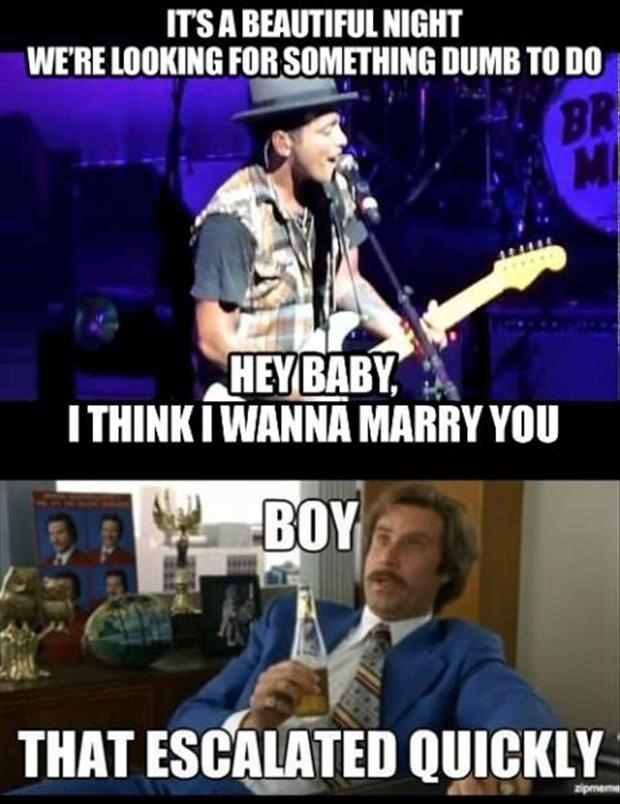
This screenshot has height=804, width=620. I want to click on bottle of beer, so click(311, 646).